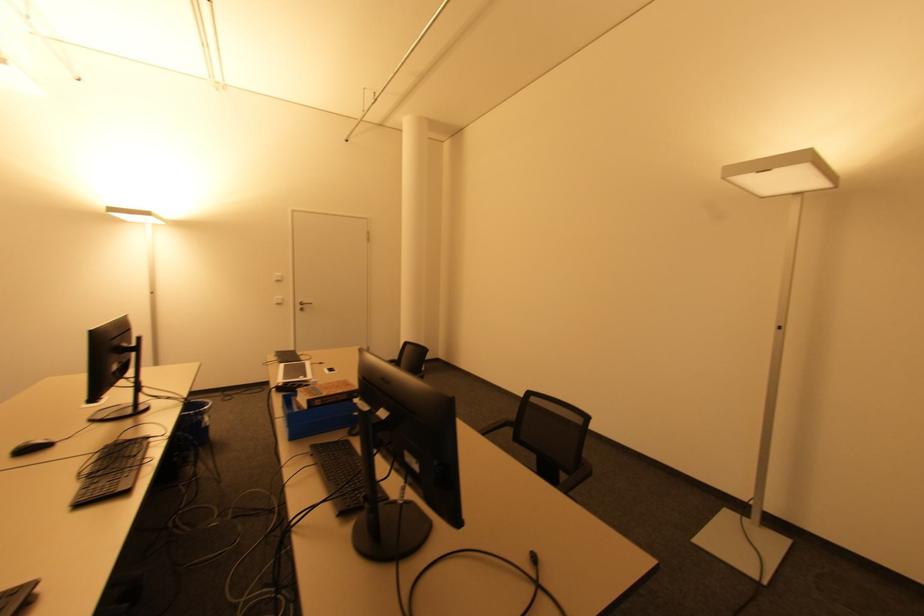
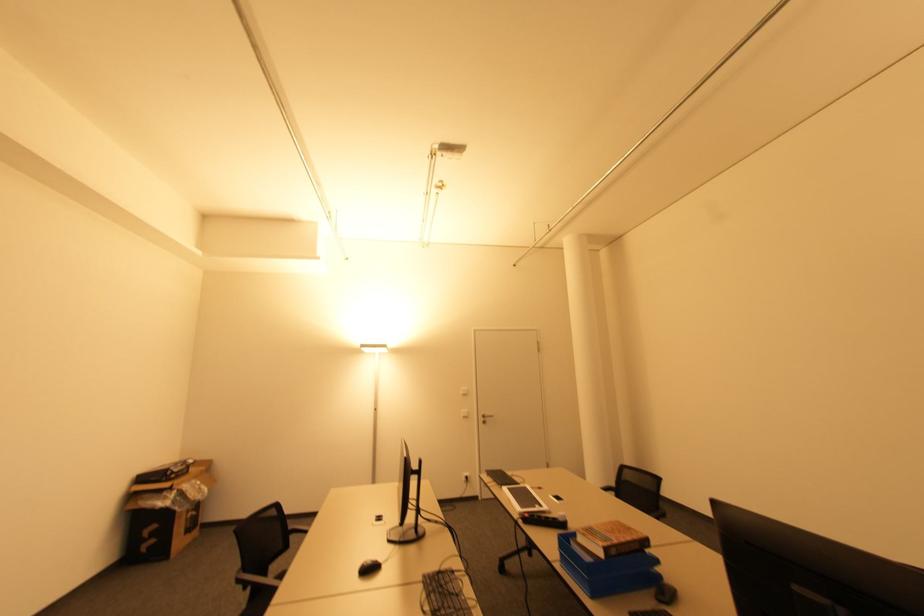
Find the pixel in the second image that matches [320,403] in the first image.

(615, 553)